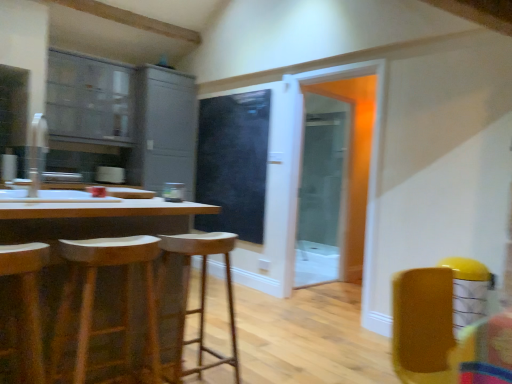
At what (x,y) coordinates should I click in order to perform the action: click on vacant space situated above black matte screen door at center, which appears as the 2th screen door when viewed from the right (from a real-world perspective). Please return your answer as a coordinate pair (x, y). Looking at the image, I should click on (228, 93).